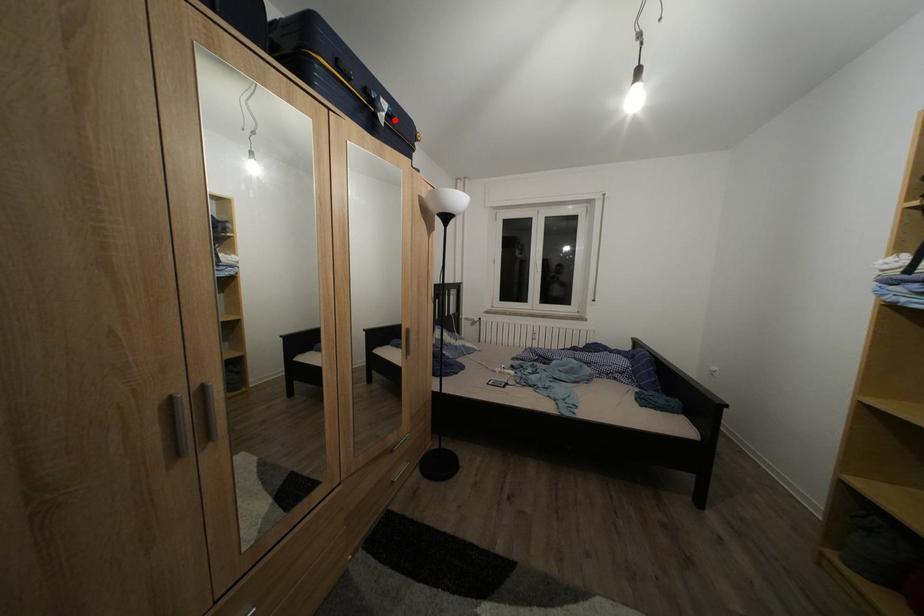
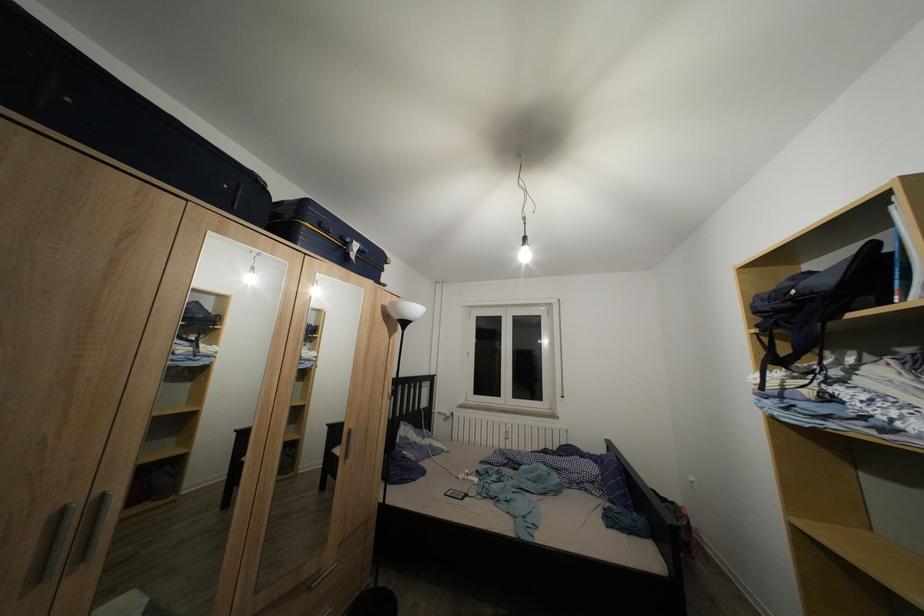
The point at the highlighted location is marked in the first image. Where is the corresponding point in the second image?

(367, 257)